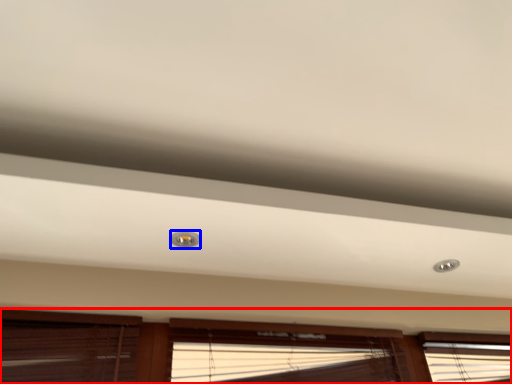
Question: Which object is closer to the camera taking this photo, window (highlighted by a red box) or droplight (highlighted by a blue box)?

Choices:
 (A) window
 (B) droplight

Answer: (A)